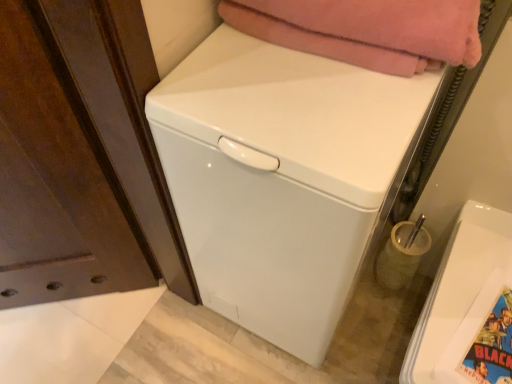
Question: Should I look upward or downward to see colorful glossy comic book at lower right?

Choices:
 (A) up
 (B) down

Answer: (B)

Question: Considering the relative sizes of white glossy washing machine at lower right, which is the 2th washing machine from left to right, and translucent glass toothbrush holder at lower right in the image provided, is white glossy washing machine at lower right, which is the 2th washing machine from left to right, thinner than translucent glass toothbrush holder at lower right?

Choices:
 (A) yes
 (B) no

Answer: (B)

Question: Is white glossy washing machine at lower right, which is the 2th washing machine from left to right, aimed at translucent glass toothbrush holder at lower right?

Choices:
 (A) no
 (B) yes

Answer: (A)

Question: Is white glossy washing machine at lower right, which is the first washing machine in right-to-left order, directly adjacent to translucent glass toothbrush holder at lower right?

Choices:
 (A) yes
 (B) no

Answer: (B)

Question: From a real-world perspective, is white glossy washing machine at lower right, which is the 2th washing machine from left to right, physically above translucent glass toothbrush holder at lower right?

Choices:
 (A) no
 (B) yes

Answer: (B)

Question: From the image's perspective, would you say white glossy washing machine at lower right, which is the 2th washing machine from left to right, is shown under translucent glass toothbrush holder at lower right?

Choices:
 (A) yes
 (B) no

Answer: (A)

Question: Would you say translucent glass toothbrush holder at lower right is part of white glossy washing machine at lower right, which is the first washing machine in right-to-left order,'s contents?

Choices:
 (A) yes
 (B) no

Answer: (B)

Question: Is white glossy washing machine at center, the first washing machine from the left, positioned with its back to colorful glossy comic book at lower right?

Choices:
 (A) yes
 (B) no

Answer: (B)

Question: Considering the relative sizes of white glossy washing machine at center, the first washing machine from the left, and colorful glossy comic book at lower right in the image provided, is white glossy washing machine at center, the first washing machine from the left, shorter than colorful glossy comic book at lower right?

Choices:
 (A) no
 (B) yes

Answer: (A)

Question: Is white glossy washing machine at center, positioned as the 2th washing machine in right-to-left order, thinner than colorful glossy comic book at lower right?

Choices:
 (A) yes
 (B) no

Answer: (B)

Question: Could you tell me if white glossy washing machine at center, positioned as the 2th washing machine in right-to-left order, is facing colorful glossy comic book at lower right?

Choices:
 (A) yes
 (B) no

Answer: (B)

Question: Does white glossy washing machine at center, positioned as the 2th washing machine in right-to-left order, have a smaller size compared to colorful glossy comic book at lower right?

Choices:
 (A) no
 (B) yes

Answer: (A)

Question: Can you confirm if white glossy washing machine at center, positioned as the 2th washing machine in right-to-left order, is bigger than colorful glossy comic book at lower right?

Choices:
 (A) no
 (B) yes

Answer: (B)

Question: Does colorful glossy comic book at lower right have a lesser width compared to soft pink blanket at upper center?

Choices:
 (A) no
 (B) yes

Answer: (B)